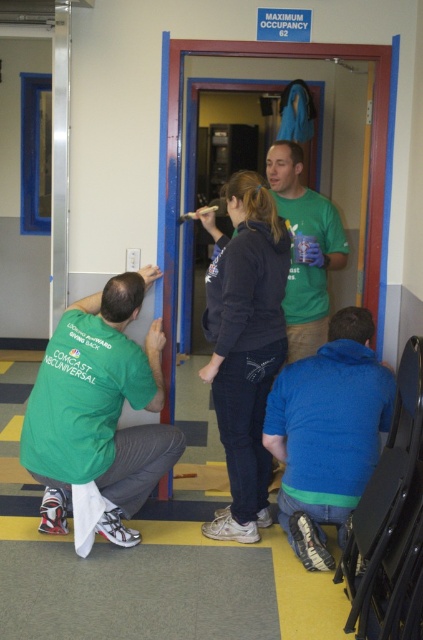
Who is higher up, blue fleece jacket at lower right or green cotton shirt at center?

green cotton shirt at center

Is blue fleece jacket at lower right to the left of green cotton shirt at center from the viewer's perspective?

Correct, you'll find blue fleece jacket at lower right to the left of green cotton shirt at center.

This screenshot has width=423, height=640. Find the location of `blue fleece jacket at lower right`. blue fleece jacket at lower right is located at coordinates (327, 433).

From the picture: Can you confirm if green matte shirt at lower left is bigger than blue fleece jacket at lower right?

Yes, green matte shirt at lower left is bigger than blue fleece jacket at lower right.

Can you confirm if green matte shirt at lower left is wider than blue fleece jacket at lower right?

Indeed, green matte shirt at lower left has a greater width compared to blue fleece jacket at lower right.

Who is more forward, (54, 380) or (368, 429)?

Point (368, 429) is in front.

At what (x,y) coordinates should I click in order to perform the action: click on green matte shirt at lower left. Please return your answer as a coordinate pair (x, y). The width and height of the screenshot is (423, 640). Looking at the image, I should click on (98, 410).

Who is positioned more to the left, green matte shirt at lower left or dark gray hoodie at center?

Positioned to the left is green matte shirt at lower left.

Which is above, green matte shirt at lower left or dark gray hoodie at center?

dark gray hoodie at center

You are a GUI agent. You are given a task and a screenshot of the screen. Output one action in this format:
    pyautogui.click(x=<x>, y=<y>)
    Task: Click on the green matte shirt at lower left
    
    Given the screenshot: What is the action you would take?
    pyautogui.click(x=98, y=410)

Where is `green matte shirt at lower left`? Image resolution: width=423 pixels, height=640 pixels. green matte shirt at lower left is located at coordinates (98, 410).